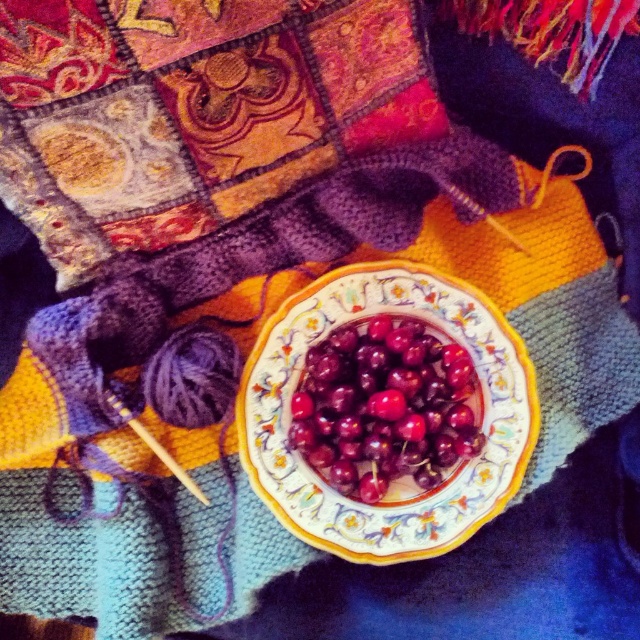
Is porcelain plate at center further to the viewer compared to shiny red cherries at center?

Yes, it is behind shiny red cherries at center.

Describe the element at coordinates (404, 484) in the screenshot. Image resolution: width=640 pixels, height=640 pixels. I see `porcelain plate at center` at that location.

Which is in front, point (364, 540) or point (435, 364)?

Point (364, 540) is in front.

Where is `porcelain plate at center`? The image size is (640, 640). porcelain plate at center is located at coordinates (404, 484).